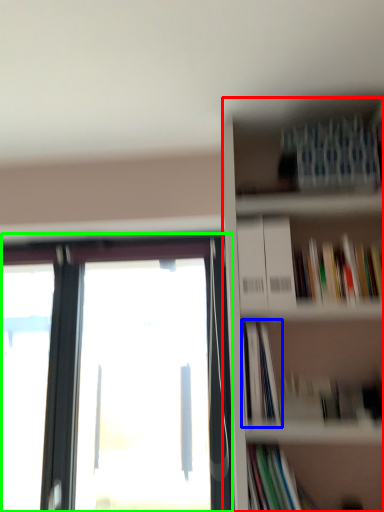
Question: Considering the real-world distances, which object is farthest from bookcase (highlighted by a red box)? book (highlighted by a blue box) or window (highlighted by a green box)?

Choices:
 (A) book
 (B) window

Answer: (B)